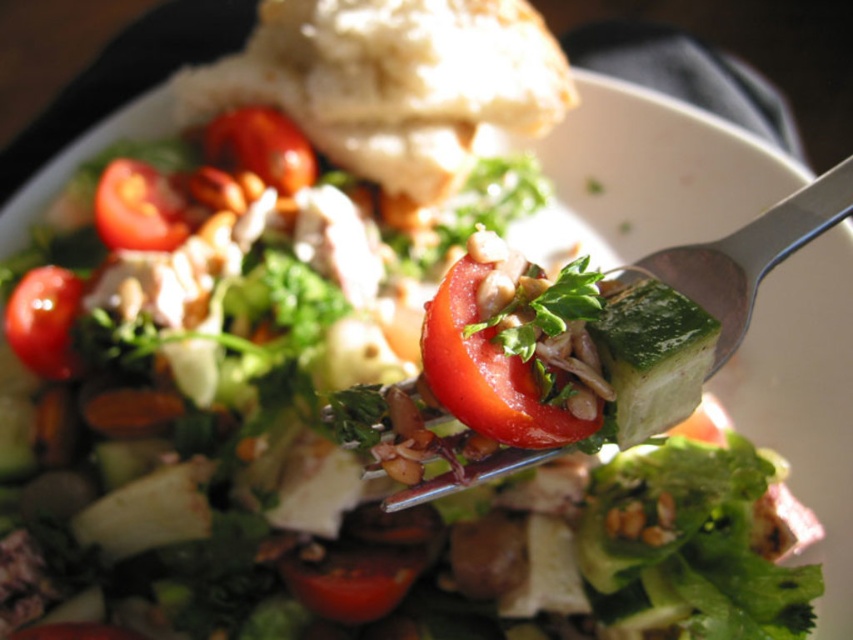
Between glossy red tomato at lower left and shiny red tomato at upper left, which one appears on the left side from the viewer's perspective?

Positioned to the left is glossy red tomato at lower left.

Find the location of a particular element. Image resolution: width=853 pixels, height=640 pixels. glossy red tomato at lower left is located at coordinates pos(44,321).

Where is `glossy red tomato at lower left`? glossy red tomato at lower left is located at coordinates (44, 321).

Can you confirm if red juicy tomato at center is smaller than glossy red tomato at center?

Correct, red juicy tomato at center occupies less space than glossy red tomato at center.

At what (x,y) coordinates should I click in order to perform the action: click on red juicy tomato at center. Please return your answer as a coordinate pair (x, y). This screenshot has width=853, height=640. Looking at the image, I should click on (486, 371).

Is glossy red tomato at lower left thinner than glossy red tomato at center?

Indeed, glossy red tomato at lower left has a lesser width compared to glossy red tomato at center.

What do you see at coordinates (44, 321) in the screenshot? I see `glossy red tomato at lower left` at bounding box center [44, 321].

You are a GUI agent. You are given a task and a screenshot of the screen. Output one action in this format:
    pyautogui.click(x=<x>, y=<y>)
    Task: Click on the glossy red tomato at lower left
    This screenshot has width=853, height=640.
    Given the screenshot: What is the action you would take?
    pyautogui.click(x=44, y=321)